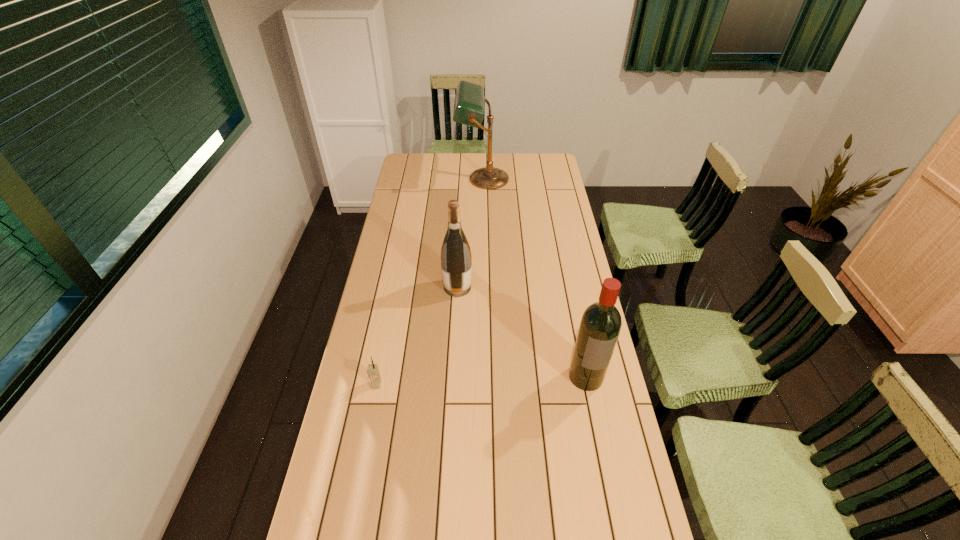
I want to click on the farthest object, so click(469, 99).

Where is `the nearer wine bottle`? This screenshot has height=540, width=960. the nearer wine bottle is located at coordinates (600, 326).

Where is `the rightmost object`? the rightmost object is located at coordinates (600, 326).

Where is `the left wine bottle`? This screenshot has width=960, height=540. the left wine bottle is located at coordinates (456, 262).

Locate an element on the screen. The width and height of the screenshot is (960, 540). the second farthest object is located at coordinates (456, 262).

At what (x,y) coordinates should I click in order to perform the action: click on the leftmost object. Please return your answer as a coordinate pair (x, y). This screenshot has width=960, height=540. Looking at the image, I should click on (372, 370).

You are a GUI agent. You are given a task and a screenshot of the screen. Output one action in this format:
    pyautogui.click(x=<x>, y=<y>)
    Task: Click on the shortest object
    
    Given the screenshot: What is the action you would take?
    (x=372, y=370)

Where is `blank space located 0.160m above the green lampshade of the farthest object`? The image size is (960, 540). blank space located 0.160m above the green lampshade of the farthest object is located at coordinates (426, 179).

This screenshot has width=960, height=540. Identify the location of blank area located above the green lampshade of the farthest object. (432, 179).

I want to click on vacant space located above the green lampshade of the farthest object, so click(426, 179).